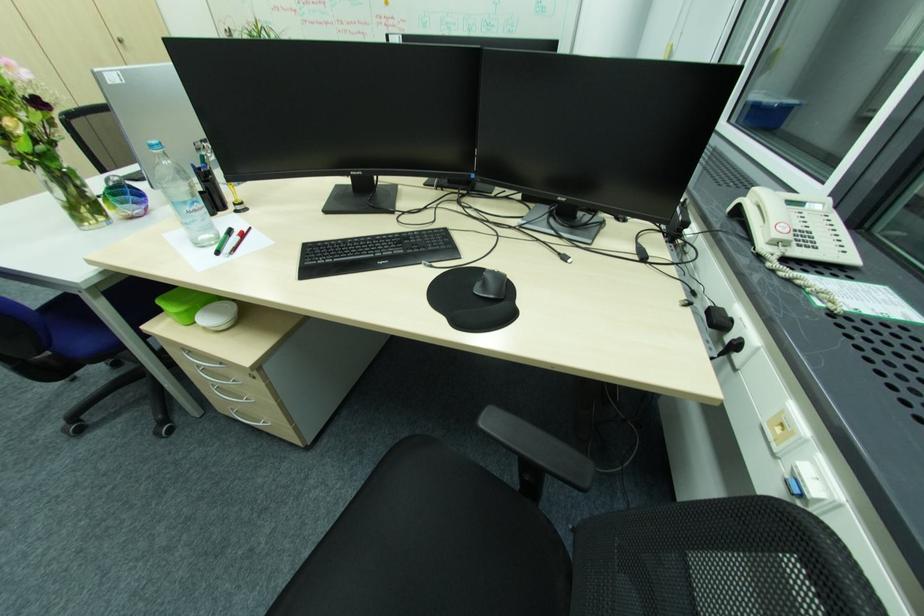
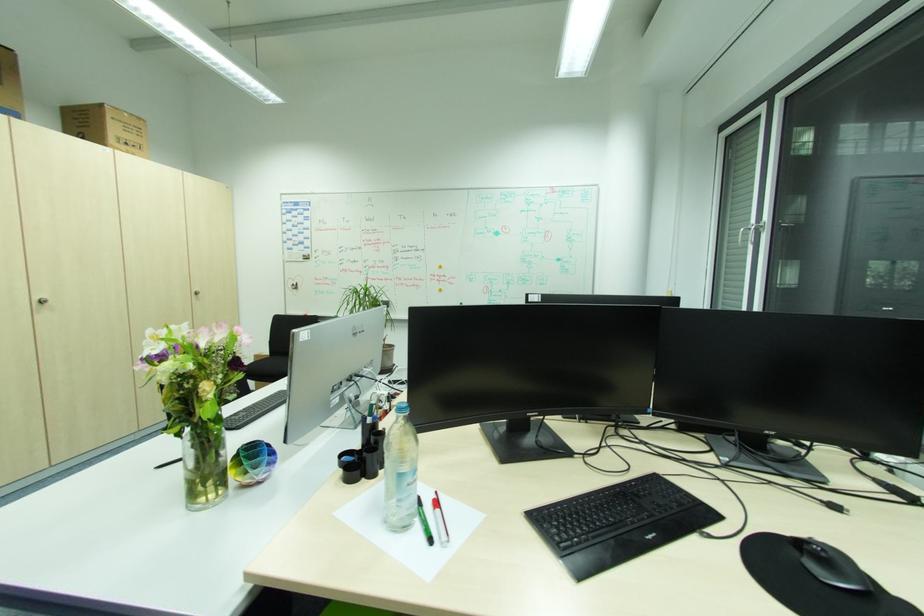
Where in the second image is the point corresponding to [249,232] from the first image?

(440, 500)